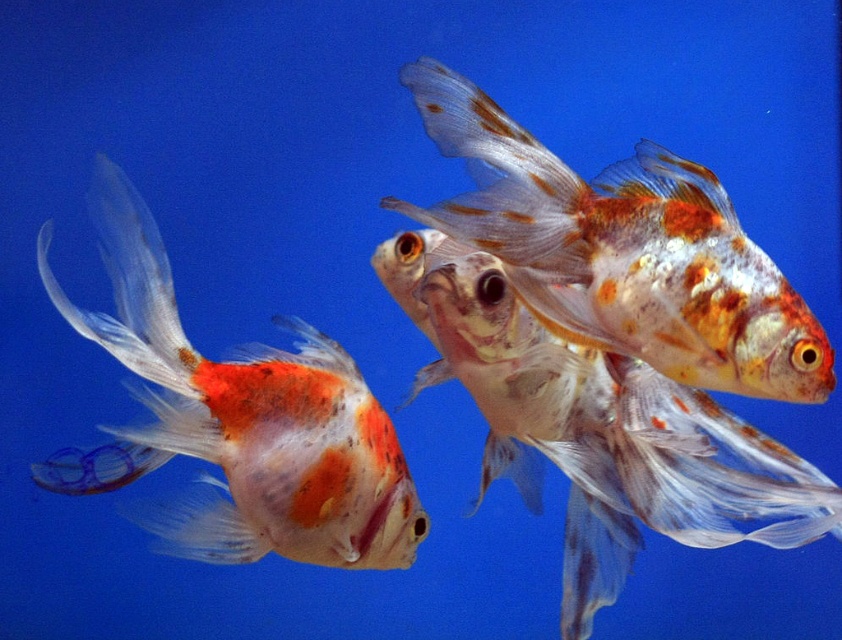
Question: Is translucent orange goldfish at left to the left of translucent orange goldfish at center from the viewer's perspective?

Choices:
 (A) yes
 (B) no

Answer: (A)

Question: Which object appears farthest from the camera in this image?

Choices:
 (A) speckled orange and white goldfish at center
 (B) translucent orange goldfish at left

Answer: (B)

Question: Can you confirm if translucent orange goldfish at center is bigger than speckled orange and white goldfish at center?

Choices:
 (A) no
 (B) yes

Answer: (B)

Question: Which object appears closest to the camera in this image?

Choices:
 (A) speckled orange and white goldfish at center
 (B) translucent orange goldfish at center
 (C) translucent orange goldfish at left

Answer: (A)

Question: Does translucent orange goldfish at center appear over speckled orange and white goldfish at center?

Choices:
 (A) no
 (B) yes

Answer: (A)

Question: Which is nearer to the speckled orange and white goldfish at center?

Choices:
 (A) translucent orange goldfish at center
 (B) translucent orange goldfish at left

Answer: (A)